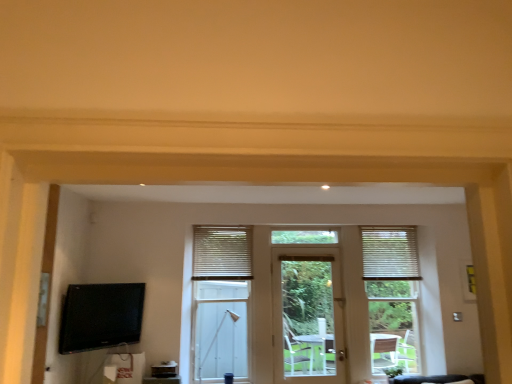
This screenshot has height=384, width=512. What do you see at coordinates (222, 253) in the screenshot?
I see `white textured blinds at center, the 1th window blind in the left-to-right sequence` at bounding box center [222, 253].

Locate an element on the screen. white wood window frame at right is located at coordinates (392, 296).

The width and height of the screenshot is (512, 384). Identify the location of black glossy tv at lower left. (101, 316).

What is the approximate height of black glossy tv at lower left?

24.12 inches.

Where is `white textured blinds at right, marked as the 1th window blind in a right-to-left arrangement`? This screenshot has width=512, height=384. white textured blinds at right, marked as the 1th window blind in a right-to-left arrangement is located at coordinates (390, 253).

Identify the location of white textured blinds at center, the 1th window blind in the left-to-right sequence. Image resolution: width=512 pixels, height=384 pixels. (222, 253).

How far apart are white wooden door at center and white textured blinds at center, the 1th window blind in the left-to-right sequence?

white wooden door at center and white textured blinds at center, the 1th window blind in the left-to-right sequence, are 29.98 inches apart from each other.

From a real-world perspective, is white wooden door at center below white textured blinds at center, the 1th window blind in the left-to-right sequence?

Yes, from a real-world perspective, white wooden door at center is beneath white textured blinds at center, the 1th window blind in the left-to-right sequence.

Considering the relative positions of white wooden door at center and white textured blinds at center, the second window blind when ordered from right to left, in the image provided, is white wooden door at center to the left of white textured blinds at center, the second window blind when ordered from right to left, from the viewer's perspective?

No.

Based on their sizes in the image, would you say white wooden door at center is bigger or smaller than white textured blinds at center, the second window blind when ordered from right to left?

Considering their sizes, white wooden door at center takes up more space than white textured blinds at center, the second window blind when ordered from right to left.

Does white textured blinds at center, the second window blind when ordered from right to left, have a greater height compared to white wooden door at center?

No, white textured blinds at center, the second window blind when ordered from right to left, is not taller than white wooden door at center.

In terms of size, does white textured blinds at center, the 1th window blind in the left-to-right sequence, appear bigger or smaller than white wooden door at center?

Considering their sizes, white textured blinds at center, the 1th window blind in the left-to-right sequence, takes up less space than white wooden door at center.

Does white textured blinds at center, the 1th window blind in the left-to-right sequence, have a lesser width compared to white wooden door at center?

Yes, white textured blinds at center, the 1th window blind in the left-to-right sequence, is thinner than white wooden door at center.

Is point (396, 243) positioned in front of point (77, 307)?

No, (396, 243) is behind (77, 307).

Can you confirm if white wood window frame at right is smaller than black glossy tv at lower left?

No.

Is white wood window frame at right behind black glossy tv at lower left?

Yes, white wood window frame at right is further from the camera.

Considering the sizes of objects white wooden door at center and black glossy tv at lower left in the image provided, who is taller, white wooden door at center or black glossy tv at lower left?

With more height is white wooden door at center.

From the image's perspective, is white wooden door at center positioned above or below black glossy tv at lower left?

Clearly, from the image's perspective, white wooden door at center is below black glossy tv at lower left.

Is white wooden door at center far from black glossy tv at lower left?

Yes, white wooden door at center and black glossy tv at lower left are quite far apart.

Relative to black glossy tv at lower left, is white wooden door at center in front or behind?

white wooden door at center is positioned farther from the viewer than black glossy tv at lower left.

Is white textured blinds at center, the 1th window blind in the left-to-right sequence, not within white wood window frame at right?

Absolutely, white textured blinds at center, the 1th window blind in the left-to-right sequence, is external to white wood window frame at right.

Which is more to the right, white textured blinds at center, the second window blind when ordered from right to left, or white wood window frame at right?

From the viewer's perspective, white wood window frame at right appears more on the right side.

Considering the relative sizes of white textured blinds at center, the second window blind when ordered from right to left, and white wood window frame at right in the image provided, is white textured blinds at center, the second window blind when ordered from right to left, wider than white wood window frame at right?

No.

From a real-world perspective, who is located lower, white textured blinds at center, the 1th window blind in the left-to-right sequence, or white wood window frame at right?

From a 3D spatial view, white wood window frame at right is below.

Based on the photo, how different are the orientations of black glossy tv at lower left and white wooden door at center in degrees?

50.8 degrees.

From the image's perspective, is black glossy tv at lower left above or below white wooden door at center?

black glossy tv at lower left is situated higher than white wooden door at center in the image.

In the image, is black glossy tv at lower left positioned in front of or behind white wooden door at center?

Clearly, black glossy tv at lower left is in front of white wooden door at center.

Can you confirm if black glossy tv at lower left is positioned to the right of white wooden door at center?

No, black glossy tv at lower left is not to the right of white wooden door at center.

In terms of height, does white textured blinds at center, the second window blind when ordered from right to left, look taller or shorter compared to white textured blinds at right, marked as the 1th window blind in a right-to-left arrangement?

In the image, white textured blinds at center, the second window blind when ordered from right to left, appears to be shorter than white textured blinds at right, marked as the 1th window blind in a right-to-left arrangement.

From the image's perspective, which one is positioned lower, white textured blinds at center, the second window blind when ordered from right to left, or white textured blinds at right, the second window blind viewed from the left?

white textured blinds at right, the second window blind viewed from the left, from the image's perspective.

Looking at this image, does white textured blinds at center, the second window blind when ordered from right to left, come in front of white textured blinds at right, the second window blind viewed from the left?

Yes.

Would you say white textured blinds at center, the 1th window blind in the left-to-right sequence, is a long distance from white textured blinds at right, marked as the 1th window blind in a right-to-left arrangement?

white textured blinds at center, the 1th window blind in the left-to-right sequence, is far away from white textured blinds at right, marked as the 1th window blind in a right-to-left arrangement.

At what (x,y) coordinates should I click in order to perform the action: click on the 1st window blind behind the white wooden door at center, starting your count from the anchor. Please return your answer as a coordinate pair (x, y). Looking at the image, I should click on click(222, 253).

This screenshot has width=512, height=384. In order to click on door located underneath the white textured blinds at center, the second window blind when ordered from right to left (from a real-world perspective) in this screenshot , I will do `click(307, 315)`.

Considering their positions, is white wood window frame at right positioned further to white wooden door at center than white textured blinds at right, the second window blind viewed from the left?

white textured blinds at right, the second window blind viewed from the left.

Considering their positions, is white wooden door at center positioned closer to black glossy tv at lower left than white textured blinds at center?

white textured blinds at center lies closer to black glossy tv at lower left than the other object.

Estimate the real-world distances between objects in this image. Which object is further from white wood window frame at right, black glossy tv at lower left or white wooden door at center?

Among the two, black glossy tv at lower left is located further to white wood window frame at right.

Considering their positions, is white textured blinds at center, the 1th window blind in the left-to-right sequence, positioned closer to white wood window frame at right than white textured blinds at right, marked as the 1th window blind in a right-to-left arrangement?

The object closer to white wood window frame at right is white textured blinds at right, marked as the 1th window blind in a right-to-left arrangement.

Which object lies further to the anchor point white textured blinds at center, white wooden door at center or white wood window frame at right?

Based on the image, white wood window frame at right appears to be further to white textured blinds at center.

When comparing their distances from white textured blinds at center, does white wooden door at center or white textured blinds at right, the second window blind viewed from the left, seem closer?

Based on the image, white wooden door at center appears to be nearer to white textured blinds at center.

From the image, which object appears to be farther from white wooden door at center, white textured blinds at center or white textured blinds at center, the second window blind when ordered from right to left?

white textured blinds at center, the second window blind when ordered from right to left.

When comparing their distances from white textured blinds at right, the second window blind viewed from the left, does white wood window frame at right or white textured blinds at center, the second window blind when ordered from right to left, seem further?

white textured blinds at center, the second window blind when ordered from right to left, lies further to white textured blinds at right, the second window blind viewed from the left, than the other object.

The width and height of the screenshot is (512, 384). I want to click on window blind located between white textured blinds at center, the second window blind when ordered from right to left, and white wood window frame at right in the left-right direction, so click(390, 253).

You are a GUI agent. You are given a task and a screenshot of the screen. Output one action in this format:
    pyautogui.click(x=<x>, y=<y>)
    Task: Click on the door situated between white textured blinds at center, the second window blind when ordered from right to left, and white wood window frame at right from left to right
    The height and width of the screenshot is (384, 512).
    Given the screenshot: What is the action you would take?
    pyautogui.click(x=307, y=315)

At what (x,y) coordinates should I click in order to perform the action: click on bay window between black glossy tv at lower left and white wooden door at center. Please return your answer as a coordinate pair (x, y). The image size is (512, 384). Looking at the image, I should click on (221, 302).

Find the location of a particular element. The width and height of the screenshot is (512, 384). bay window located between black glossy tv at lower left and white textured blinds at right, marked as the 1th window blind in a right-to-left arrangement, in the left-right direction is located at coordinates (221, 302).